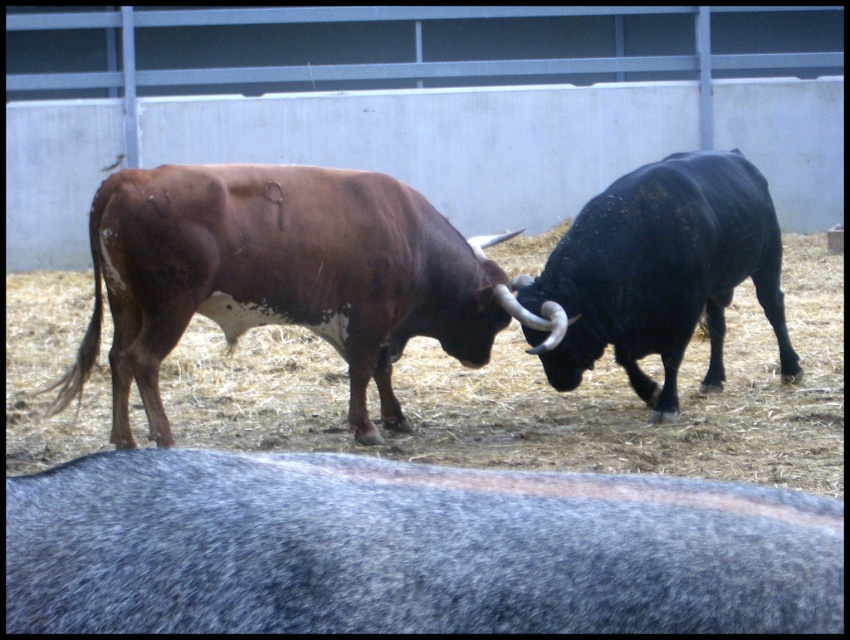
Question: Which point is closer to the camera?

Choices:
 (A) brown rough hide bull at center
 (B) black glossy bull at right

Answer: (A)

Question: Where is brown rough hide bull at center located in relation to black glossy bull at right in the image?

Choices:
 (A) right
 (B) left

Answer: (B)

Question: Is brown rough hide bull at center to the right of black glossy bull at right from the viewer's perspective?

Choices:
 (A) no
 (B) yes

Answer: (A)

Question: Among these objects, which one is nearest to the camera?

Choices:
 (A) black glossy bull at right
 (B) brown rough hide bull at center
 (C) gray woolen yak at lower center

Answer: (C)

Question: Is brown rough hide bull at center behind black glossy bull at right?

Choices:
 (A) yes
 (B) no

Answer: (B)

Question: Which object is farther from the camera taking this photo?

Choices:
 (A) brown rough hide bull at center
 (B) black glossy bull at right
 (C) gray woolen yak at lower center

Answer: (B)